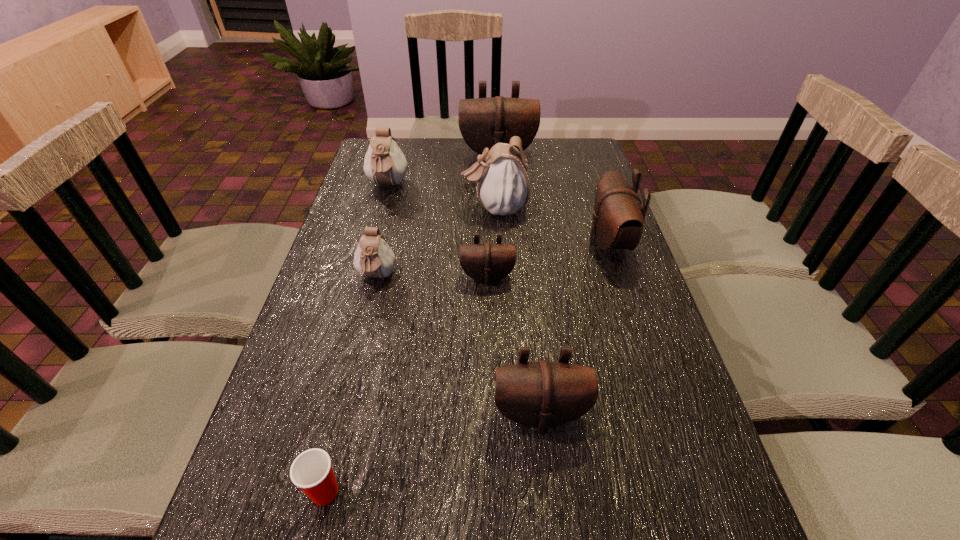
Locate an element on the screen. This screenshot has height=540, width=960. the farthest object is located at coordinates (483, 122).

I want to click on the biggest brown pouch, so click(x=483, y=122).

I want to click on the rightmost white pouch, so click(503, 180).

Find the location of a particular element. the rightmost brown pouch is located at coordinates (618, 218).

Identify the location of the rightmost pouch. This screenshot has height=540, width=960. (618, 218).

Locate an element on the screen. The height and width of the screenshot is (540, 960). the second biggest white pouch is located at coordinates (384, 163).

In order to click on the seventh farthest object in this screenshot , I will do coord(542,394).

You are a GUI agent. You are given a task and a screenshot of the screen. Output one action in this format:
    pyautogui.click(x=<x>, y=<y>)
    Task: Click on the third biggest brown pouch
    This screenshot has height=540, width=960.
    Given the screenshot: What is the action you would take?
    pyautogui.click(x=542, y=394)

Find the location of a particular element. This screenshot has height=540, width=960. the smallest white pouch is located at coordinates click(373, 258).

Identify the location of the smallest brown pouch. (486, 262).